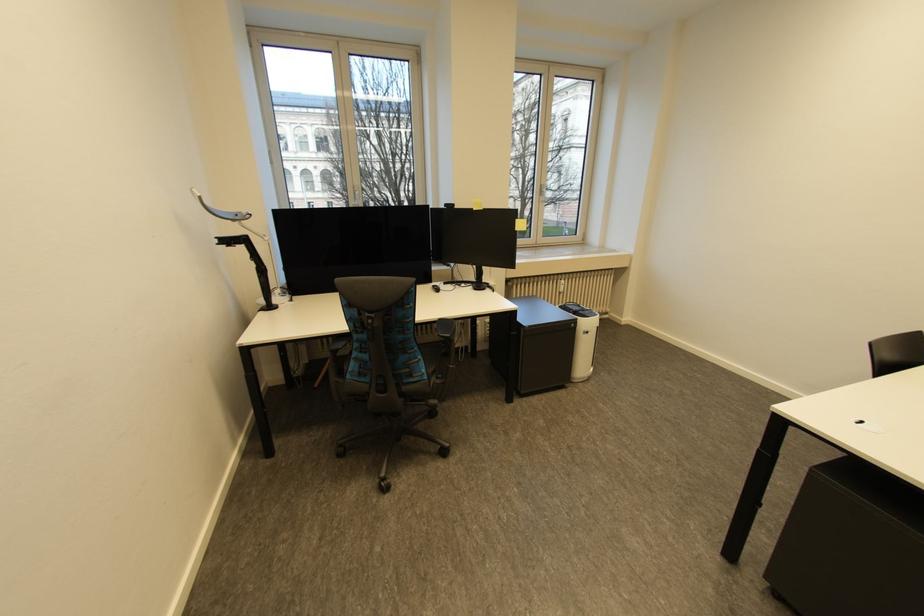
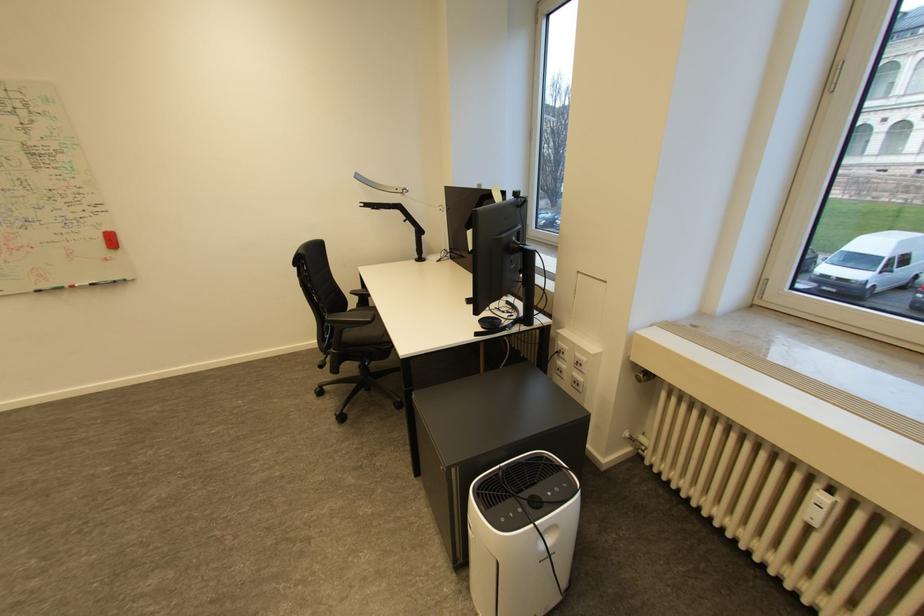
Find the pixel in the second image that matches [248,249] in the first image.

(405, 213)